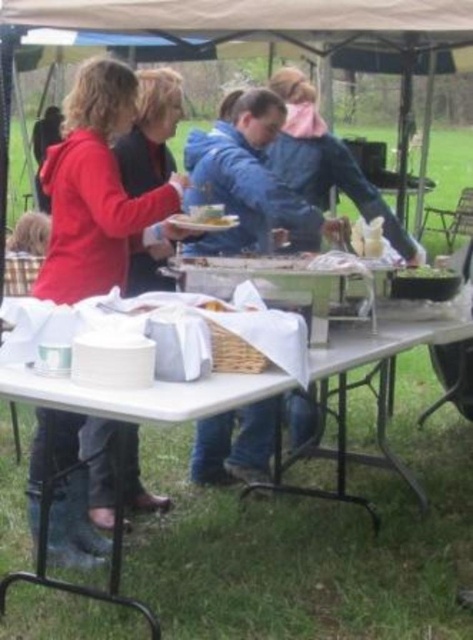
In the scene shown: Does white cloth-covered picnic table at lower center have a larger size compared to green leafy salad at center?

Indeed, white cloth-covered picnic table at lower center has a larger size compared to green leafy salad at center.

Can you confirm if white cloth-covered picnic table at lower center is taller than green leafy salad at center?

Yes, white cloth-covered picnic table at lower center is taller than green leafy salad at center.

Image resolution: width=473 pixels, height=640 pixels. Find the location of `white cloth-covered picnic table at lower center`. white cloth-covered picnic table at lower center is located at coordinates (315, 541).

Locate an element on the screen. The height and width of the screenshot is (640, 473). blue denim jacket at center is located at coordinates (245, 177).

Is blue denim jacket at center closer to camera compared to white paper plate at center?

No.

I want to click on blue denim jacket at center, so click(245, 177).

Who is positioned more to the right, white cloth-covered picnic table at lower center or white paper plate at center?

white cloth-covered picnic table at lower center

Is point (348, 588) more distant than point (174, 224)?

No, (348, 588) is closer to viewer.

Where is `white cloth-covered picnic table at lower center`? This screenshot has height=640, width=473. white cloth-covered picnic table at lower center is located at coordinates (315, 541).